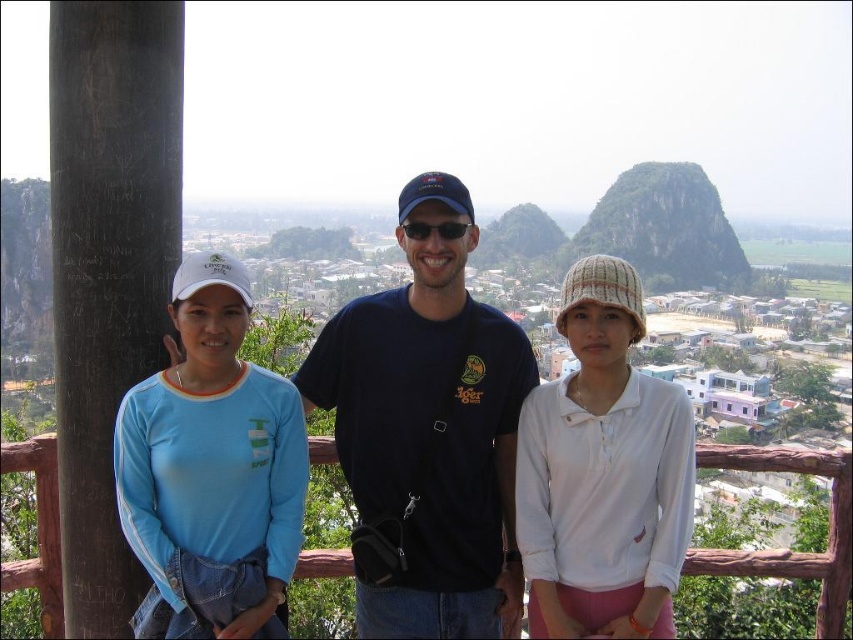
Question: Is the position of black cotton t-shirt at center more distant than that of rugged stone mountain at upper center?

Choices:
 (A) yes
 (B) no

Answer: (B)

Question: Can you confirm if matte blue shirt at center is wider than black cotton t-shirt at center?

Choices:
 (A) yes
 (B) no

Answer: (A)

Question: Which point is farther to the camera?

Choices:
 (A) matte blue shirt at center
 (B) black cotton t-shirt at center
 (C) light blue fabric shirt at left

Answer: (B)

Question: Among these points, which one is nearest to the camera?

Choices:
 (A) (270, 394)
 (B) (503, 380)
 (C) (578, 324)

Answer: (A)

Question: Does black wood pillar at left come behind light blue fabric shirt at left?

Choices:
 (A) yes
 (B) no

Answer: (B)

Question: Which point is closer to the camera?

Choices:
 (A) light blue fabric shirt at left
 (B) matte blue shirt at center
 (C) rugged stone mountain at upper center

Answer: (A)